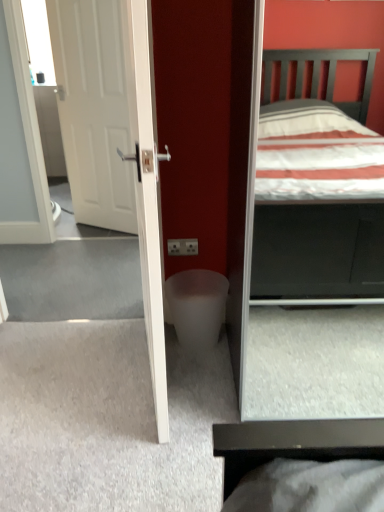
Locate an element on the screen. The width and height of the screenshot is (384, 512). vacant area that is in front of white frosted glass at center is located at coordinates click(203, 389).